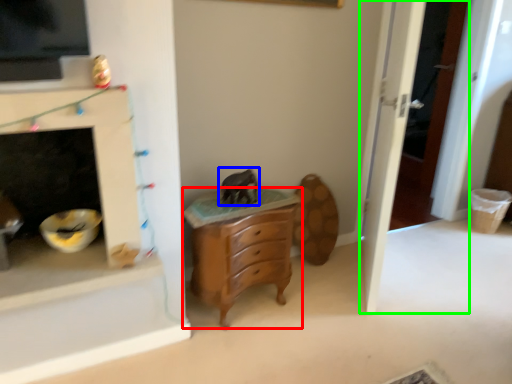
Question: Which object is positioned closest to chest of drawers (highlighted by a red box)? Select from animal (highlighted by a blue box) and door (highlighted by a green box).

Choices:
 (A) animal
 (B) door

Answer: (A)